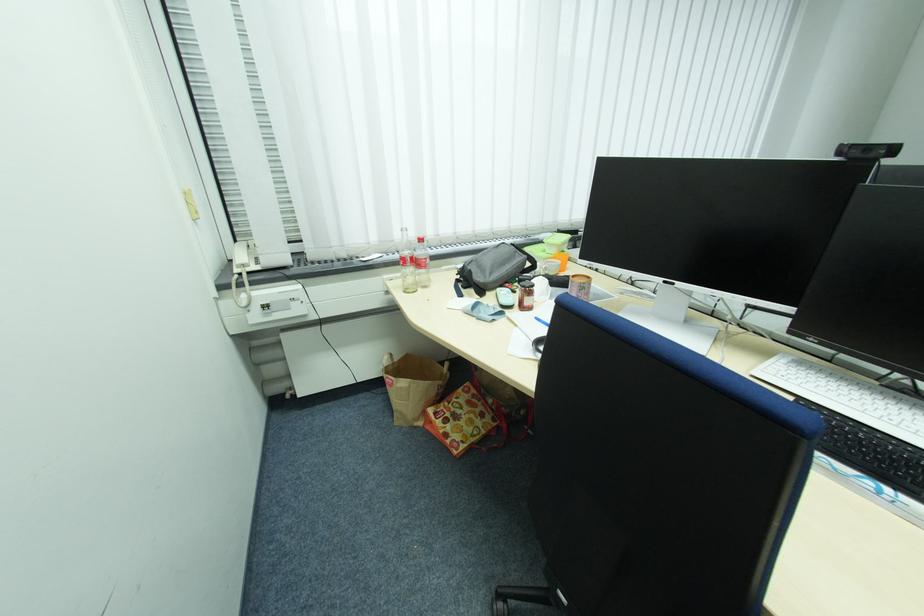
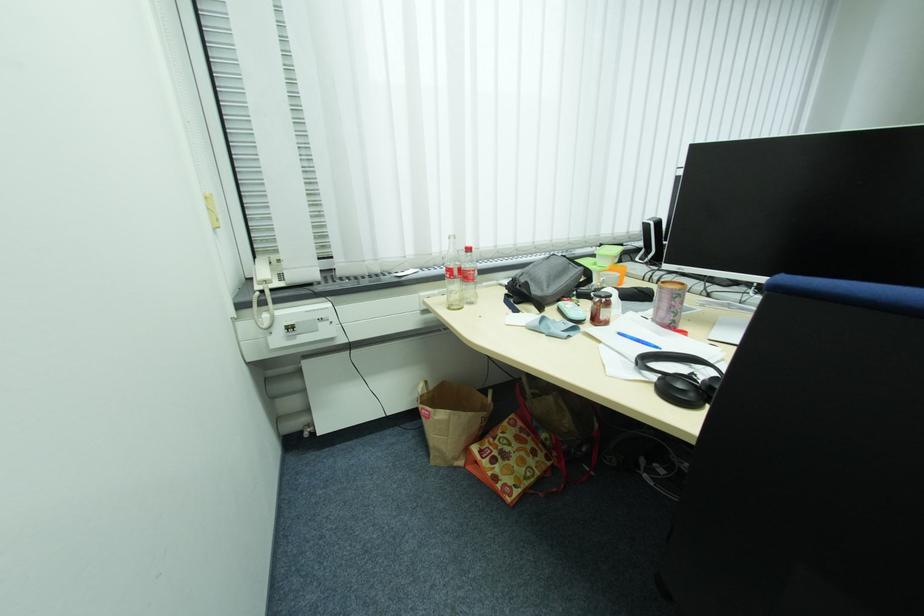
Find the pixel in the second image that matches (533,302) in the first image.

(610, 315)